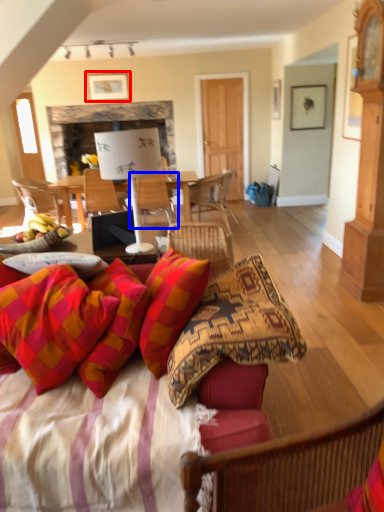
Question: Among these objects, which one is farthest to the camera, picture frame (highlighted by a red box) or chair (highlighted by a blue box)?

Choices:
 (A) picture frame
 (B) chair

Answer: (A)